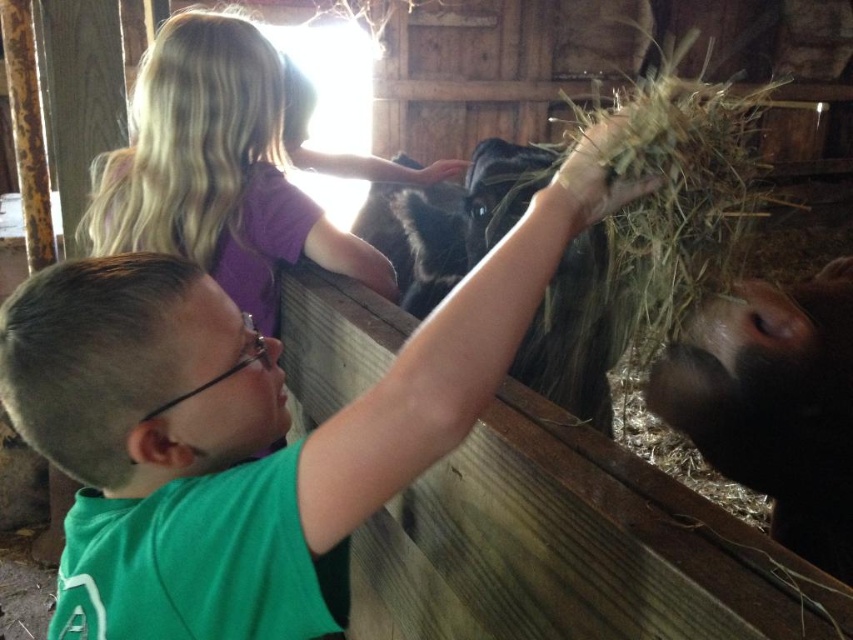
In the barn scene, there is a green matte shirt at upper center and a wooden partition. Based on their positions, can you tell me which object is closer to the light source coming from the window at the back?

The green matte shirt at upper center is closer to the light source because it is positioned at point (252, 419), which is closer to the window at the back compared to the wooden partition.

Consider the image. You are a photographer trying to capture a closeup shot of the green matte shirt at upper center and the black matte cow at right. Since you can only focus on one subject at a time, which one would you choose to ensure it appears clearer in the photo?

The green matte shirt at upper center is larger in size compared to the black matte cow at right, so focusing on the green matte shirt at upper center would ensure it appears clearer in the photo.